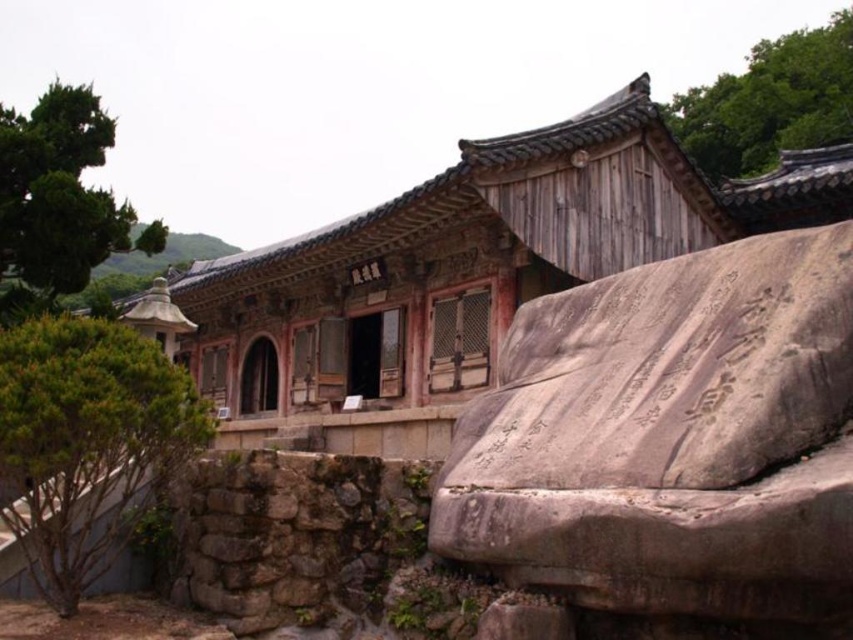
Question: Is gray stone carving at center smaller than green leafy tree at upper left?

Choices:
 (A) yes
 (B) no

Answer: (A)

Question: Is the position of gray stone carving at center more distant than that of green grassy hillside at upper left?

Choices:
 (A) no
 (B) yes

Answer: (A)

Question: Which point appears farthest from the camera in this image?

Choices:
 (A) (792, 124)
 (B) (137, 259)
 (C) (103, 150)
 (D) (126, 513)

Answer: (B)

Question: Is green leafy bush at lower left to the right of green leafy tree at upper right from the viewer's perspective?

Choices:
 (A) no
 (B) yes

Answer: (A)

Question: Which point appears closest to the camera in this image?

Choices:
 (A) (761, 115)
 (B) (7, 214)
 (C) (831, 420)

Answer: (C)

Question: Which of the following is the farthest from the observer?

Choices:
 (A) green leafy bush at lower left
 (B) green grassy hillside at upper left
 (C) green leafy tree at upper left
 (D) green leafy tree at upper right

Answer: (D)